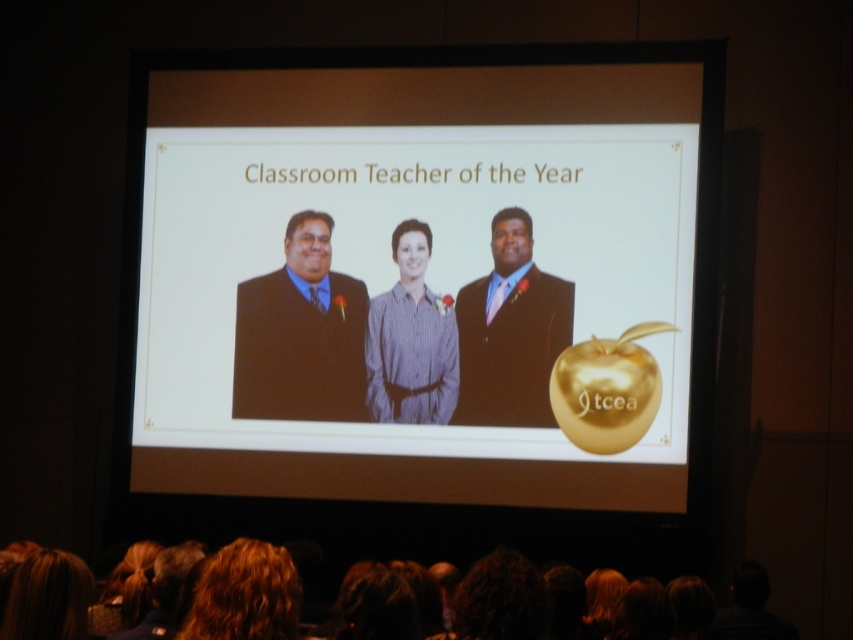
From the picture: You are a photographer adjusting your camera settings to focus on two points in the image. One is point 1 at position (451, 387) and the other is point 2 at (297, 595). Since the photographer wants to focus on the closer point to ensure clarity, which point should they focus on?

Point 2 at (297, 595) is closer to the camera than point 1 at (451, 387), so the photographer should focus on point 2 at (297, 595) to ensure clarity.

You are an event photographer at the back of the room. You need to take a photo of the black suit at center and curly brown hair at lower center. Which one is positioned to the left of the other?

The black suit at center is positioned to the left of curly brown hair at lower center.